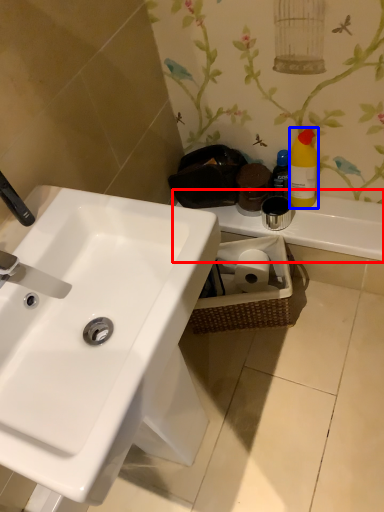
Question: Which object is closer to the camera taking this photo, counter top (highlighted by a red box) or cleaning product (highlighted by a blue box)?

Choices:
 (A) counter top
 (B) cleaning product

Answer: (B)